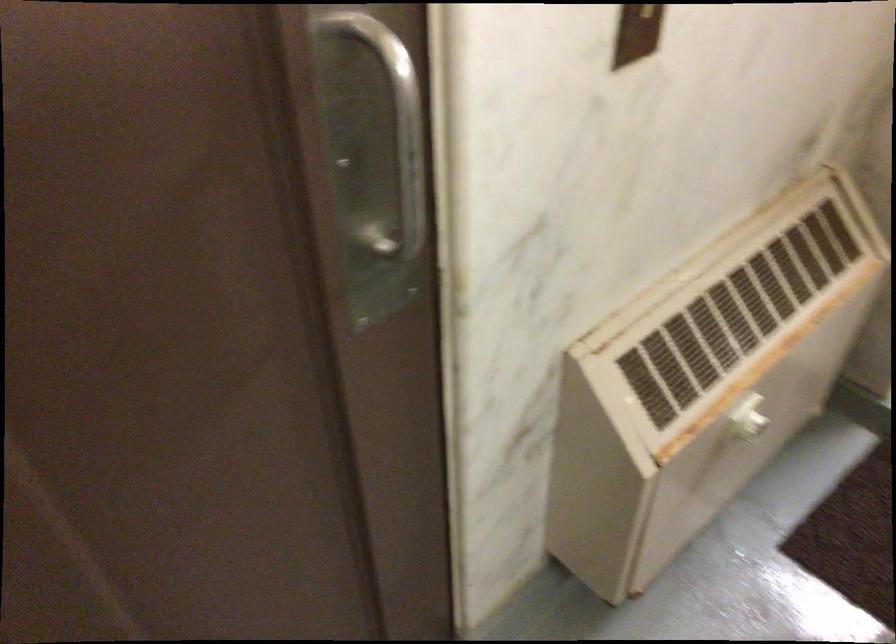
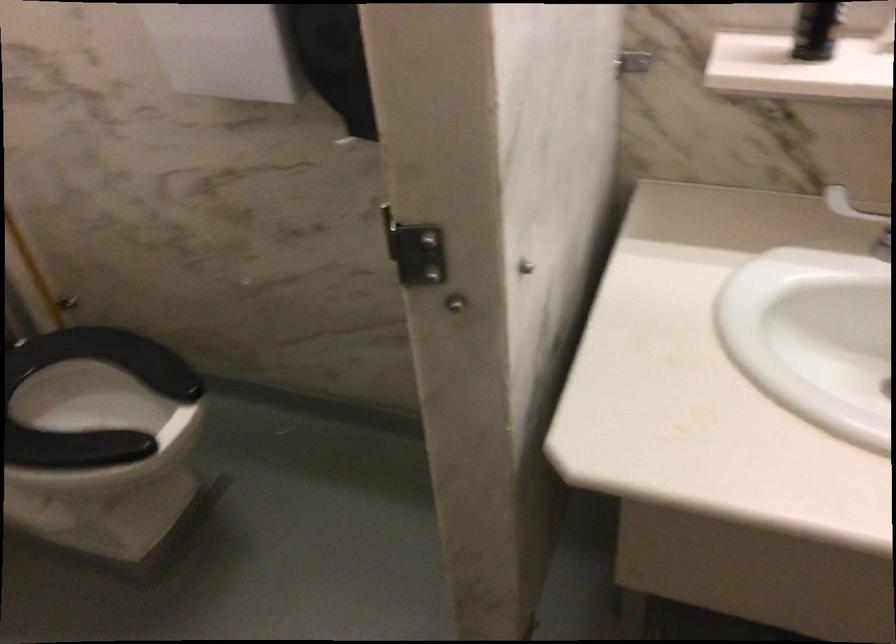
Looking at this image, the images are taken continuously from a first-person perspective. In which direction is your viewpoint rotating?

The rotation direction of the camera is right-down.